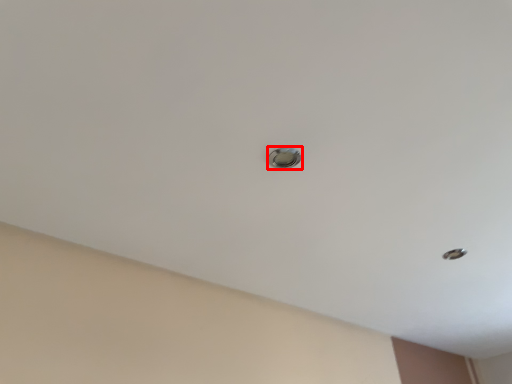
Question: Considering the relative positions of door handle (annotated by the red box) and hole in the image provided, where is door handle (annotated by the red box) located with respect to the staircase?

Choices:
 (A) right
 (B) left

Answer: (B)